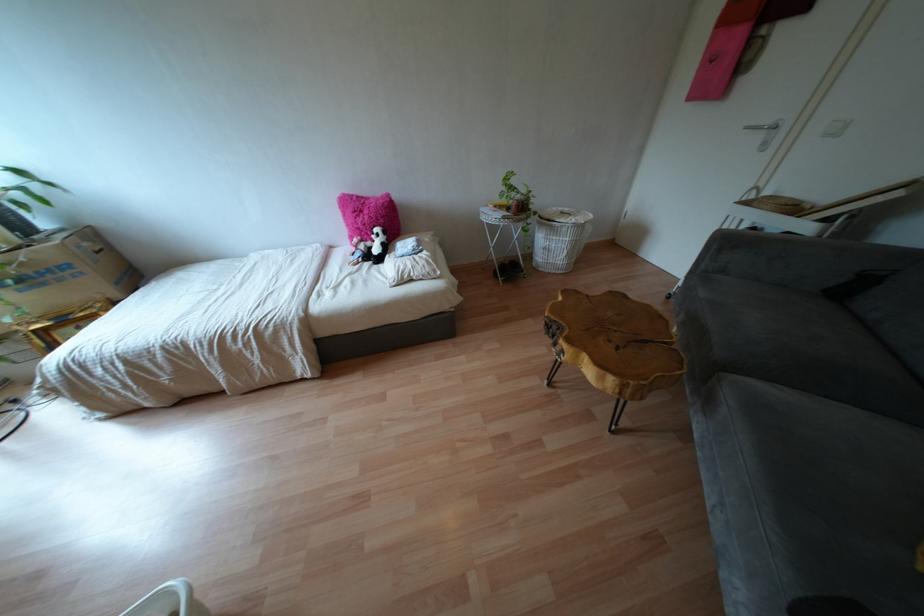
I want to click on sofa armrest, so click(796, 257).